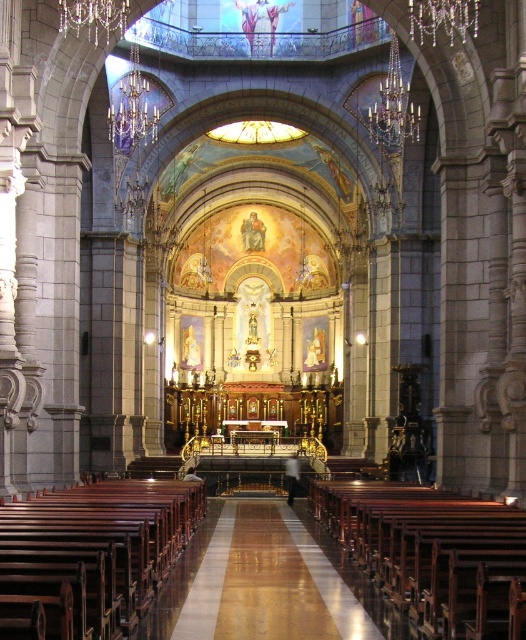
Is shiny polished wood aisle at center shorter than crystal glass chandelier at upper center?

No, shiny polished wood aisle at center is not shorter than crystal glass chandelier at upper center.

Image resolution: width=526 pixels, height=640 pixels. What do you see at coordinates (268, 582) in the screenshot?
I see `shiny polished wood aisle at center` at bounding box center [268, 582].

You are a GUI agent. You are given a task and a screenshot of the screen. Output one action in this format:
    pyautogui.click(x=<x>, y=<y>)
    Task: Click on the shiny polished wood aisle at center
    
    Given the screenshot: What is the action you would take?
    pyautogui.click(x=268, y=582)

Locate an element on the screen. shiny polished wood aisle at center is located at coordinates (268, 582).

Does polished wood pews at center appear on the right side of clear crystal chandelier at upper center?

In fact, polished wood pews at center is to the left of clear crystal chandelier at upper center.

Can you confirm if polished wood pews at center is positioned below clear crystal chandelier at upper center?

Yes, polished wood pews at center is below clear crystal chandelier at upper center.

Identify the location of polished wood pews at center. The height and width of the screenshot is (640, 526). (106, 544).

Between point (177, 556) and point (107, 36), which one is positioned behind?

The point (107, 36) is more distant.

The height and width of the screenshot is (640, 526). I want to click on polished wood pews at center, so click(x=106, y=544).